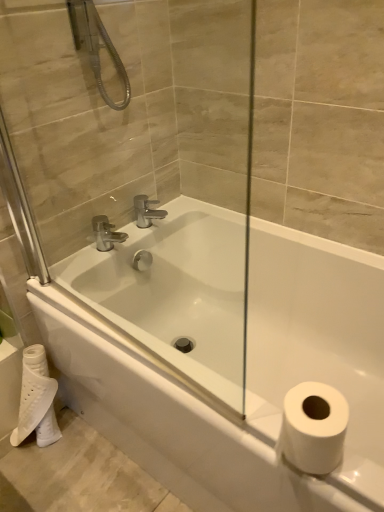
Question: From a real-world perspective, is white glossy bathtub at center above or below transparent glass door at center?

Choices:
 (A) above
 (B) below

Answer: (B)

Question: Considering the positions of white glossy bathtub at center and transparent glass door at center in the image, is white glossy bathtub at center taller or shorter than transparent glass door at center?

Choices:
 (A) tall
 (B) short

Answer: (B)

Question: Considering the real-world distances, which object is closest to the white glossy bathtub at center?

Choices:
 (A) transparent glass door at center
 (B) polished chrome faucet at upper center
 (C) white matte toilet paper at lower left

Answer: (A)

Question: Which is nearer to the white glossy bathtub at center?

Choices:
 (A) transparent glass door at center
 (B) polished chrome faucet at upper center
 (C) white matte toilet paper at lower left

Answer: (A)